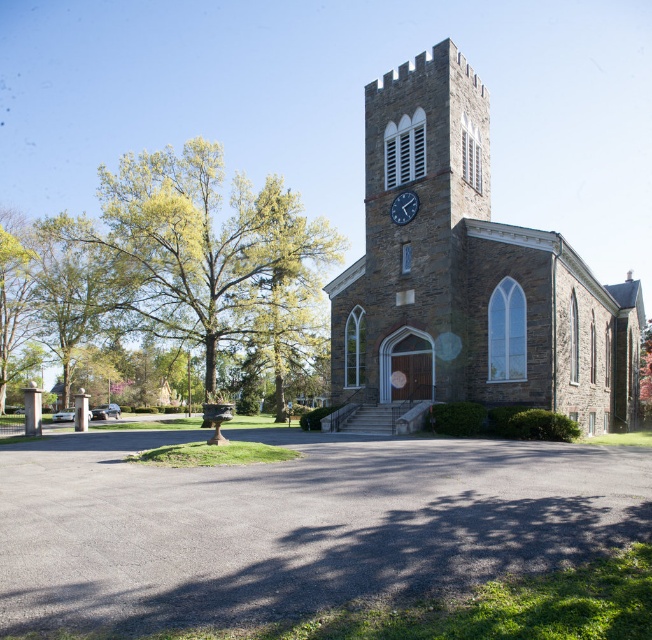
Question: Which point is closer to the camera?

Choices:
 (A) (409, 193)
 (B) (464, 200)
 (C) (261, 276)

Answer: (B)

Question: Does stone church at center appear on the right side of metallic clock at upper center?

Choices:
 (A) no
 (B) yes

Answer: (B)

Question: Does stone church at center come behind metallic clock at upper center?

Choices:
 (A) no
 (B) yes

Answer: (A)

Question: Which point appears farthest from the camera in this image?

Choices:
 (A) (391, 212)
 (B) (213, 384)
 (C) (527, 330)

Answer: (B)

Question: Is stone church at center smaller than metallic clock at upper center?

Choices:
 (A) no
 (B) yes

Answer: (A)

Question: Which point is closer to the camera?

Choices:
 (A) stone church at center
 (B) green leafy tree at left

Answer: (A)